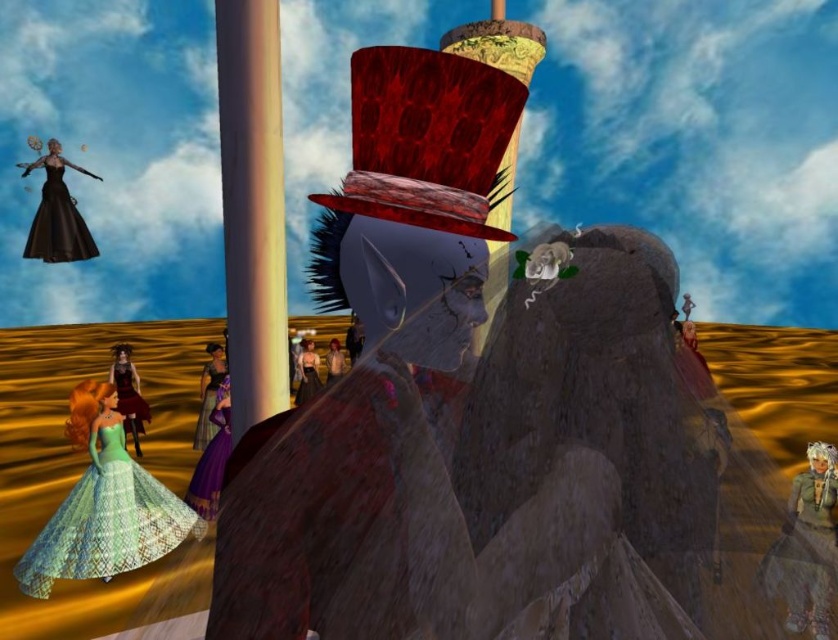
Question: Among these objects, which one is nearest to the camera?

Choices:
 (A) purple satin dress at center
 (B) black satin dress at upper left
 (C) matte gray dress at lower right

Answer: (C)

Question: Does black satin dress at upper left come in front of matte purple dress at center?

Choices:
 (A) no
 (B) yes

Answer: (B)

Question: Can you confirm if shiny gold dress at center is positioned to the right of matte purple dress at center?

Choices:
 (A) no
 (B) yes

Answer: (A)

Question: Which point is closer to the camera taking this photo?

Choices:
 (A) (314, 384)
 (B) (104, 465)

Answer: (B)

Question: Is purple satin dress at center to the left of matte purple dress at center from the viewer's perspective?

Choices:
 (A) no
 (B) yes

Answer: (B)

Question: Which point is closer to the camera taking this photo?

Choices:
 (A) (34, 164)
 (B) (221, 468)

Answer: (B)